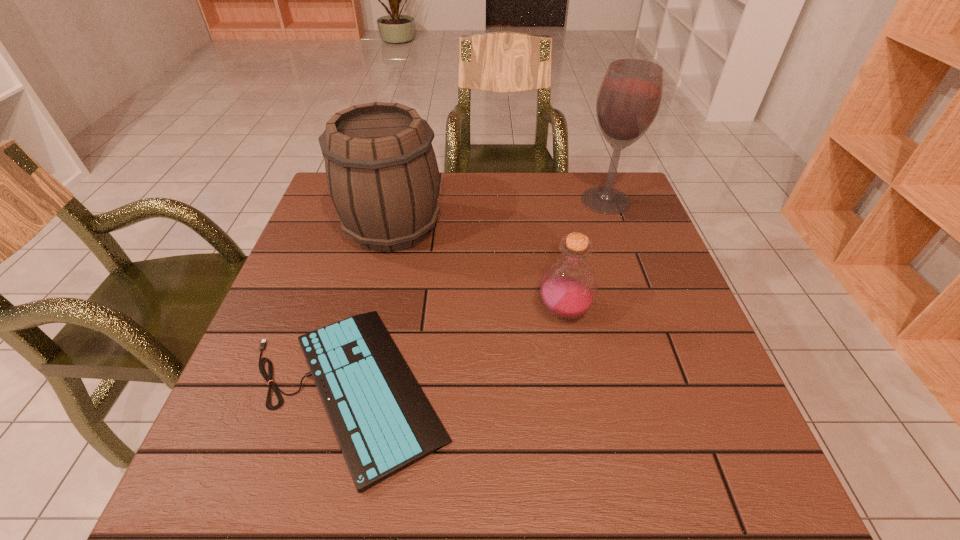
Where is `free spot between the rightmost object and the third shortest object`? This screenshot has height=540, width=960. free spot between the rightmost object and the third shortest object is located at coordinates (499, 214).

This screenshot has width=960, height=540. What are the coordinates of `vacant area that lies between the third tallest object and the third shortest object` in the screenshot? It's located at (478, 269).

This screenshot has height=540, width=960. Find the location of `vacant area that lies between the tallest object and the shortest object`. vacant area that lies between the tallest object and the shortest object is located at coordinates (477, 294).

Where is `vacant region between the second shortest object and the second tallest object`? This screenshot has width=960, height=540. vacant region between the second shortest object and the second tallest object is located at coordinates pyautogui.click(x=478, y=269).

Locate an element on the screen. the closest object to the wine bucket is located at coordinates (383, 422).

What are the coordinates of `object that is the second closest to the third shortest object` in the screenshot? It's located at (568, 288).

At what (x,y) coordinates should I click in order to perform the action: click on vacant area in the image that satisfies the following two spatial constraints: 1. on the back side of the shortest object; 2. on the right side of the alcohol. Please return your answer as a coordinate pair (x, y). Looking at the image, I should click on (395, 200).